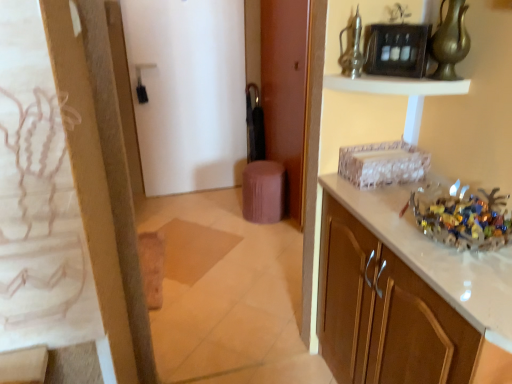
You are a GUI agent. You are given a task and a screenshot of the screen. Output one action in this format:
    pyautogui.click(x=<x>, y=<y>)
    Task: Click on the vacant space to the left of gold metallic vase at upper right, the 1th glass vase viewed from the right
    
    Given the screenshot: What is the action you would take?
    pyautogui.click(x=407, y=82)